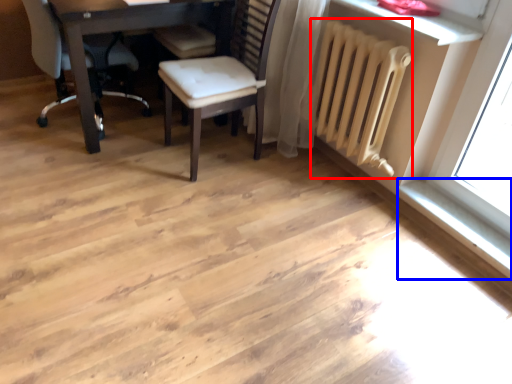
Question: Which object is further to the camera taking this photo, radiator (highlighted by a red box) or window sill (highlighted by a blue box)?

Choices:
 (A) radiator
 (B) window sill

Answer: (B)